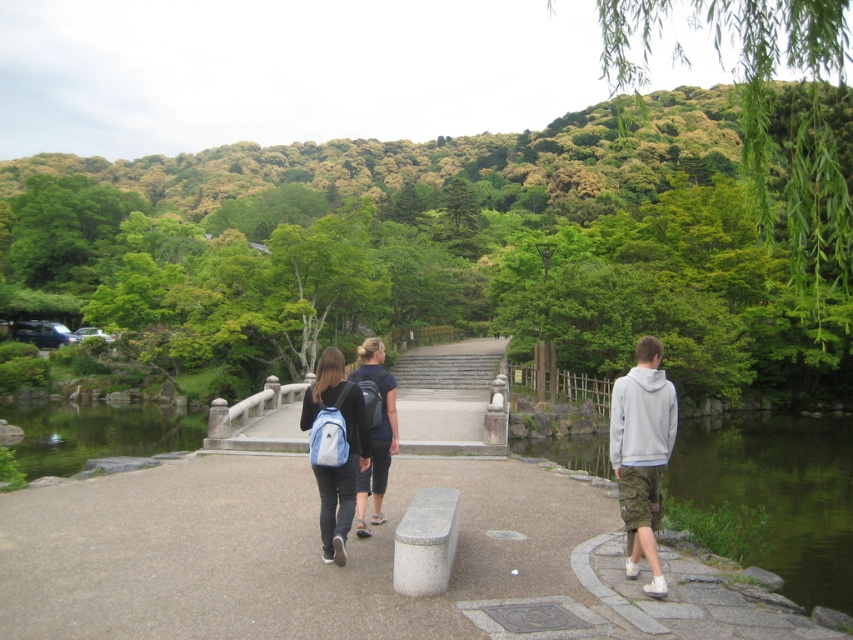
Is green smooth water at lower left above light blue backpack at center?

No.

Who is more forward, (184, 426) or (350, 513)?

Positioned in front is point (350, 513).

Which is behind, point (189, 449) or point (303, 408)?

The point (189, 449) is behind.

Identify the location of green smooth water at lower left. (96, 433).

The width and height of the screenshot is (853, 640). What do you see at coordinates (96, 433) in the screenshot?
I see `green smooth water at lower left` at bounding box center [96, 433].

Can you confirm if green smooth water at lower left is positioned to the right of gray cotton hoodie at right?

No, green smooth water at lower left is not to the right of gray cotton hoodie at right.

Locate an element on the screen. The height and width of the screenshot is (640, 853). green smooth water at lower left is located at coordinates [96, 433].

Is smooth stone steps at center wider than gray cotton hoodie at right?

Indeed, smooth stone steps at center has a greater width compared to gray cotton hoodie at right.

Can you confirm if smooth stone steps at center is shorter than gray cotton hoodie at right?

No.

Is point (482, 346) positioned after point (631, 564)?

Yes, it is behind point (631, 564).

Find the location of a particular element. The width and height of the screenshot is (853, 640). smooth stone steps at center is located at coordinates (450, 397).